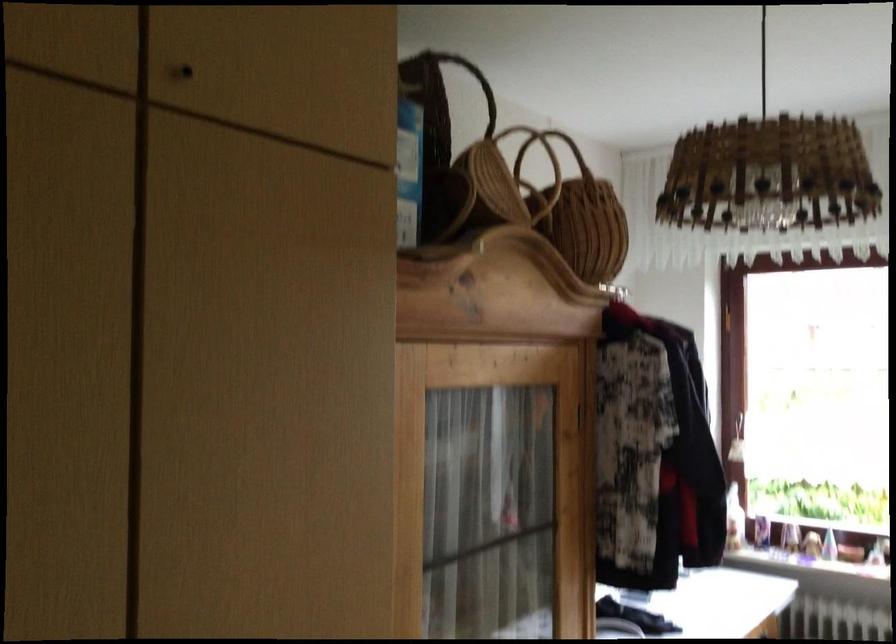
Where would you lift the arched basket handle? Please return your answer as a coordinate pair (x, y).

(469, 82)